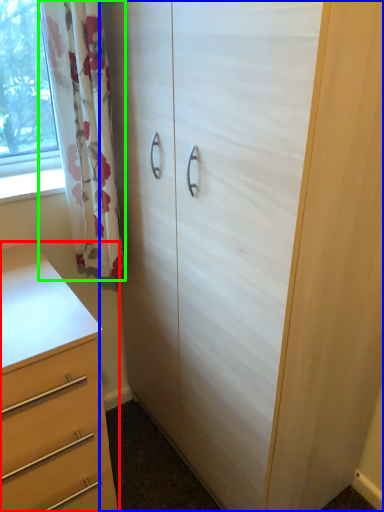
Question: Considering the real-world distances, which object is closest to chest of drawers (highlighted by a red box)? cupboard (highlighted by a blue box) or curtain (highlighted by a green box).

Choices:
 (A) cupboard
 (B) curtain

Answer: (B)